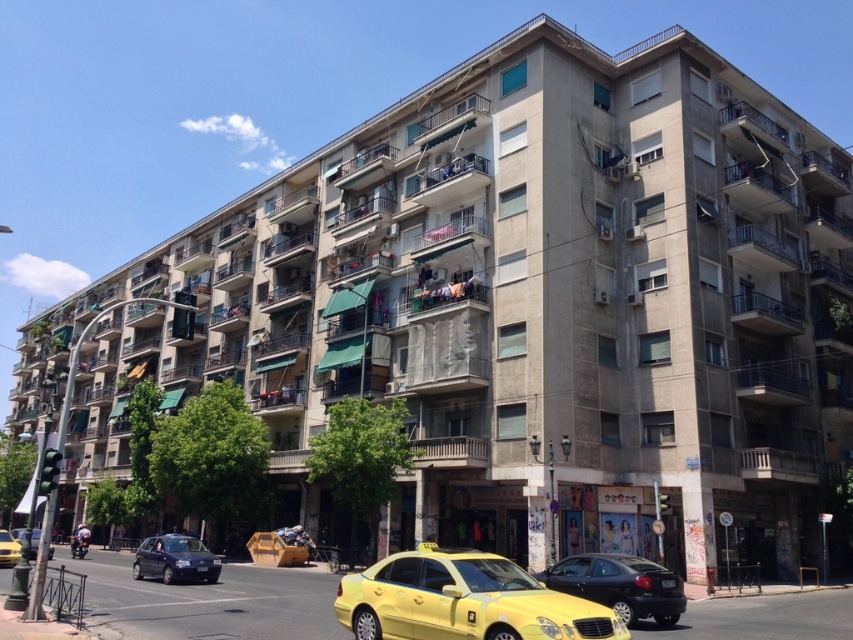
Question: Which point is farther to the camera?

Choices:
 (A) (404, 628)
 (B) (18, 556)
 (C) (671, 579)
 (D) (51, 552)

Answer: (D)

Question: Is black glossy sedan at center bigger than yellow metallic taxi at center?

Choices:
 (A) no
 (B) yes

Answer: (A)

Question: Is black glossy sedan at center below black plastic license plate at lower center?

Choices:
 (A) yes
 (B) no

Answer: (A)

Question: Which point appears closest to the camera in this image?

Choices:
 (A) (3, 554)
 (B) (15, 536)

Answer: (A)

Question: Among these objects, which one is nearest to the camera?

Choices:
 (A) black glossy sedan at center
 (B) dark blue metallic hatchback at lower left

Answer: (A)

Question: Does yellow matte taxi at lower center have a greater width compared to black plastic license plate at lower center?

Choices:
 (A) no
 (B) yes

Answer: (B)